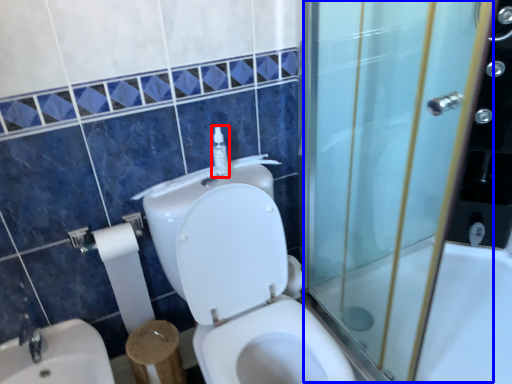
Question: Which object is further to the camera taking this photo, soap dispenser (highlighted by a red box) or screen door (highlighted by a blue box)?

Choices:
 (A) soap dispenser
 (B) screen door

Answer: (A)